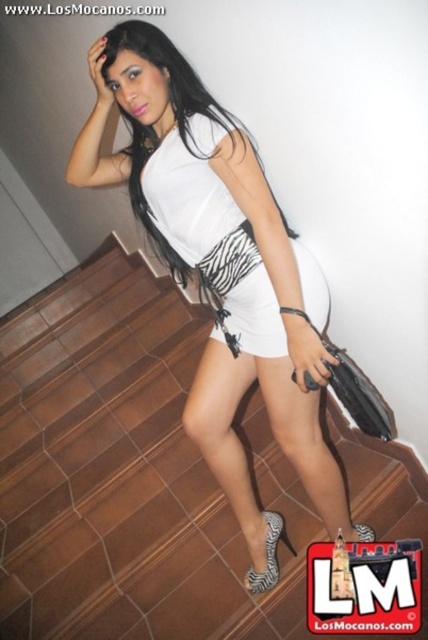
Question: Does white zebra-patterned shorts at center appear on the left side of zebra print fabric sandal at lower center?

Choices:
 (A) no
 (B) yes

Answer: (B)

Question: Is brown wooden stairs at lower left wider than white matte zebra print dress at center?

Choices:
 (A) no
 (B) yes

Answer: (B)

Question: Which of the following is the closest to the observer?

Choices:
 (A) white zebra-patterned shorts at center
 (B) white matte tank top at center
 (C) white matte zebra print dress at center

Answer: (B)

Question: From the image, what is the correct spatial relationship of white zebra-patterned shorts at center in relation to zebra print fabric sandal at lower center?

Choices:
 (A) right
 (B) left

Answer: (B)

Question: Which object is the farthest from the white matte tank top at center?

Choices:
 (A) brown wooden stairs at lower left
 (B) zebra print fabric high-heeled sandal at lower center
 (C) white matte zebra print dress at center

Answer: (A)

Question: Based on their relative distances, which object is farther from the white matte tank top at center?

Choices:
 (A) zebra print fabric sandal at lower center
 (B) white zebra-patterned shorts at center
 (C) white matte zebra print dress at center
 (D) brown wooden stairs at lower left

Answer: (D)